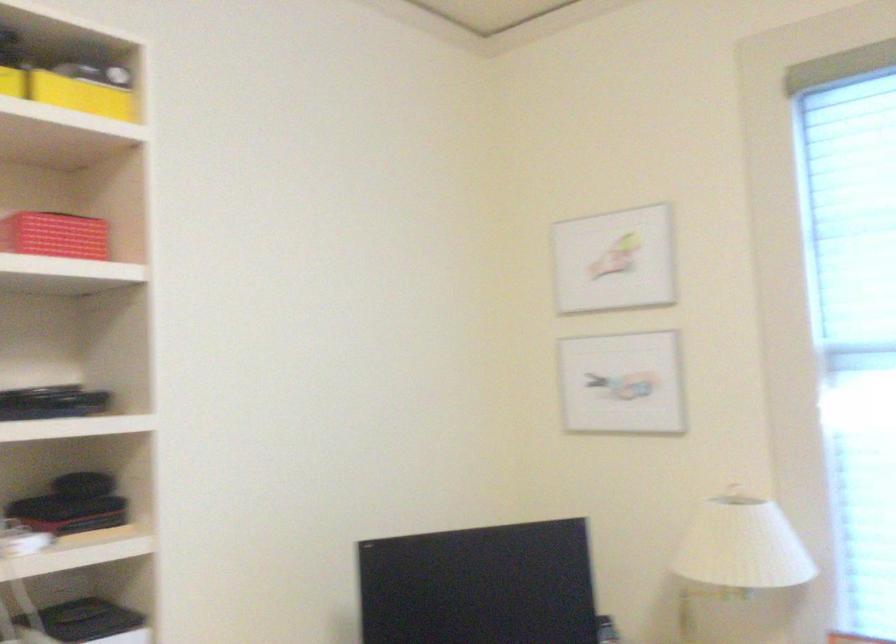
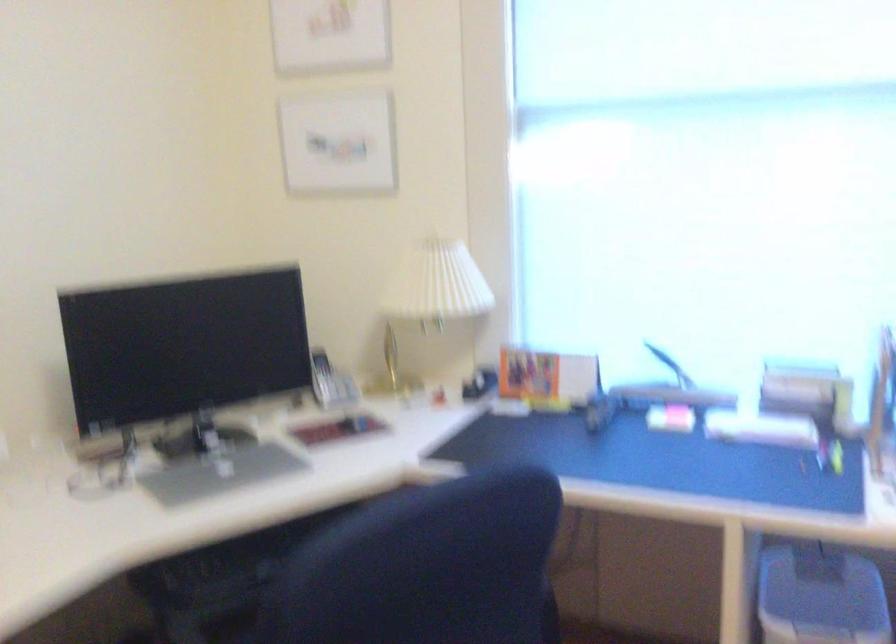
The first image is from the beginning of the video and the second image is from the end. How did the camera likely rotate when shooting the video?

The rotation direction of the camera is right-down.